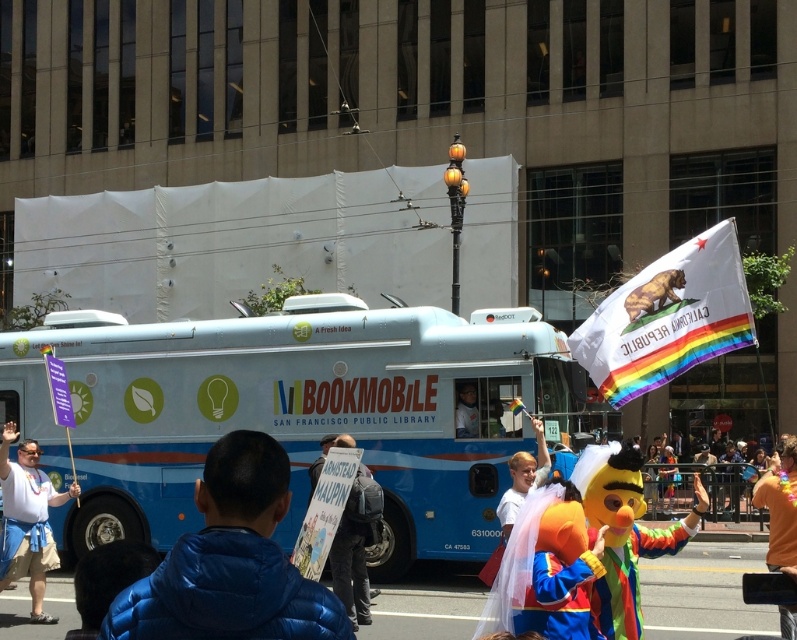
Question: Can you confirm if blue matte bookmobile at center is positioned below rainbow fabric sesame street character at center?

Choices:
 (A) yes
 (B) no

Answer: (A)

Question: Based on their relative distances, which object is nearer to the blue fabric shirt at left?

Choices:
 (A) white fabric flag at upper right
 (B) blue puffer jacket at lower center

Answer: (A)

Question: Does rainbow fabric sesame street character at center have a greater width compared to orange fabric at lower right?

Choices:
 (A) yes
 (B) no

Answer: (B)

Question: Is white tulle at center positioned in front of matte white bus at center?

Choices:
 (A) no
 (B) yes

Answer: (B)

Question: Which point is farther to the camera?

Choices:
 (A) (183, 611)
 (B) (595, 493)
 (C) (544, 470)
 (D) (473, 401)

Answer: (D)

Question: Estimate the real-world distances between objects in this image. Which object is farther from the blue fabric sign at center?

Choices:
 (A) white tulle at center
 (B) blue fabric shirt at left
 (C) blue puffer jacket at lower center
 (D) blue matte bookmobile at center

Answer: (C)